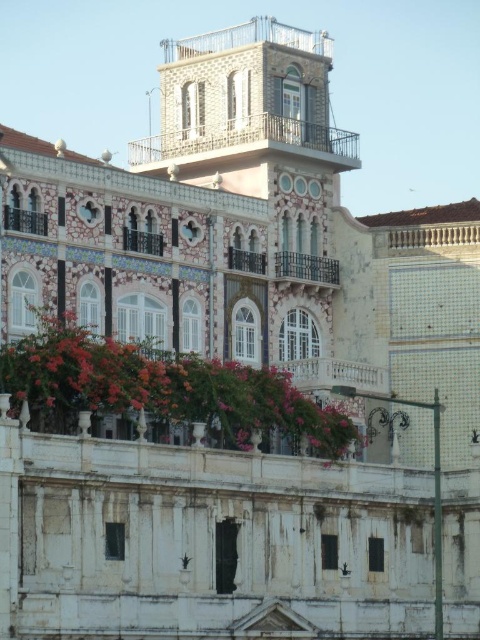
Question: From the image, what is the correct spatial relationship of vivid pink petals at center in relation to metallic wrought iron balcony at upper left?

Choices:
 (A) below
 (B) above

Answer: (A)

Question: Can you confirm if vivid pink petals at center is positioned to the left of metallic wrought iron balcony at upper left?

Choices:
 (A) yes
 (B) no

Answer: (B)

Question: Among these points, which one is nearest to the camera?

Choices:
 (A) (344, 145)
 (B) (231, 364)
 (C) (19, 212)

Answer: (C)

Question: Among these objects, which one is farthest from the camera?

Choices:
 (A) metallic wrought iron balcony at upper left
 (B) rustic wood balcony at center
 (C) white stone balcony at center
 (D) vivid pink petals at center

Answer: (B)

Question: Estimate the real-world distances between objects in this image. Which object is farther from the vivid pink petals at center?

Choices:
 (A) rustic wood balcony at center
 (B) metallic railing at upper center
 (C) white stone balcony at center

Answer: (B)

Question: Considering the relative positions of vivid pink petals at center and white stone balcony at center in the image provided, where is vivid pink petals at center located with respect to white stone balcony at center?

Choices:
 (A) left
 (B) right

Answer: (A)